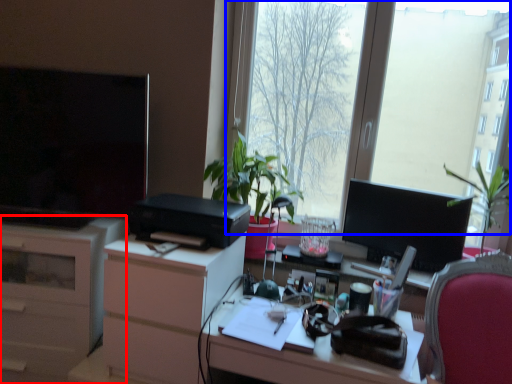
Question: Among these objects, which one is farthest to the camera, cabinetry (highlighted by a red box) or window (highlighted by a blue box)?

Choices:
 (A) cabinetry
 (B) window

Answer: (A)